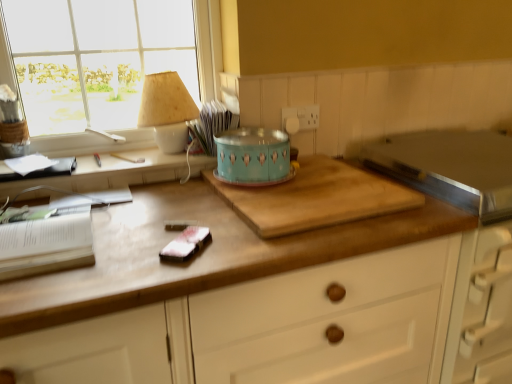
Find the location of a particular element. The width and height of the screenshot is (512, 384). vacant space to the left of matte beige lampshade at upper left is located at coordinates (115, 153).